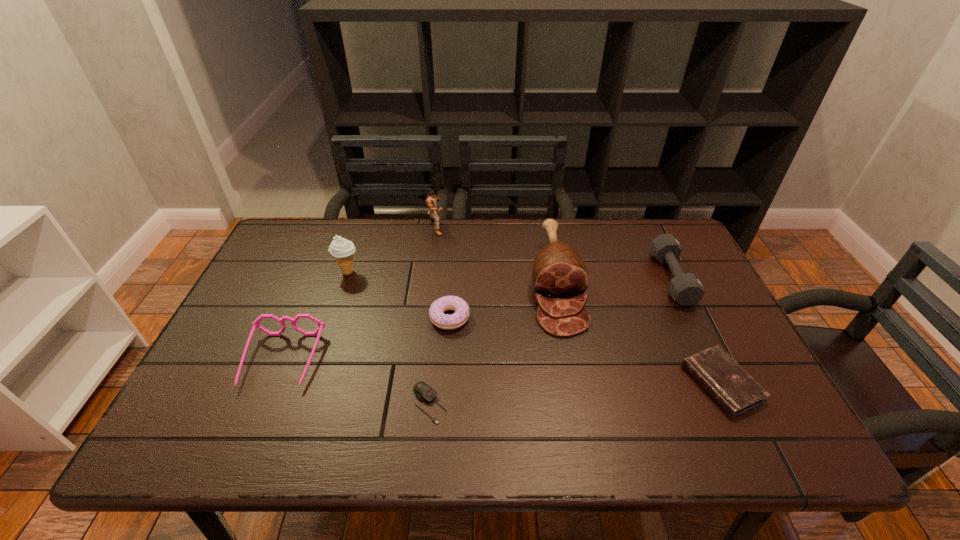
This screenshot has width=960, height=540. In the image, there is a desktop. What are the coordinates of `free space at the far right corner` in the screenshot? It's located at (644, 222).

I want to click on vacant area at the near right corner of the desktop, so click(x=755, y=424).

Identify the location of free area in between the sixth object from left to right and the seventh tallest object. (638, 334).

Where is `vacant space in between the spectacles and the puncher`? The height and width of the screenshot is (540, 960). vacant space in between the spectacles and the puncher is located at coordinates (359, 294).

Where is `free space that is in between the mouse and the spectacles`? free space that is in between the mouse and the spectacles is located at coordinates (356, 382).

Where is `free space between the spectacles and the icecream`? Image resolution: width=960 pixels, height=540 pixels. free space between the spectacles and the icecream is located at coordinates (315, 316).

Find the location of a particular element. The height and width of the screenshot is (540, 960). blank region between the icecream and the farthest object is located at coordinates (392, 249).

Locate an element on the screen. This screenshot has width=960, height=540. vacant space that's between the icecream and the shortest object is located at coordinates (389, 338).

Locate an element on the screen. The image size is (960, 540). unoccupied position between the diary and the shortest object is located at coordinates click(575, 394).

Identify the location of vacant point located between the shortest object and the dumbbell. The height and width of the screenshot is (540, 960). (551, 341).